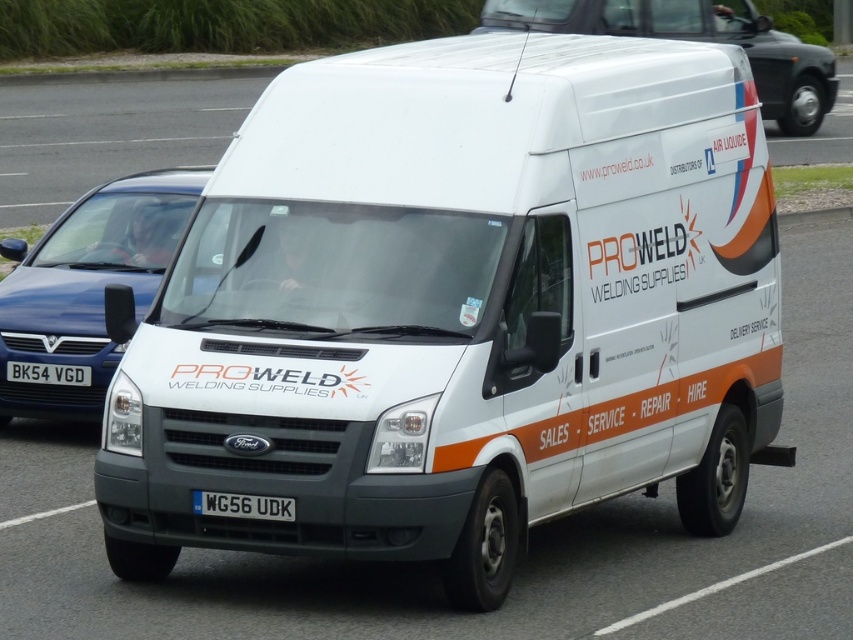
You are standing in front of the van and notice two points marked on its side. The first point is at coordinate (277, 497) and the second is at (21, 369). Which point is closer to you?

Point (277, 497) is closer to the camera than point (21, 369).

You are a delivery driver who needs to confirm the vehicle you are driving matches the company records. According to the image, which object is bigger in size between the white matte van at upper center and the white plastic license plate at center?

The white matte van at upper center is larger in size compared to the white plastic license plate at center.

You are a delivery driver who needs to attach a GPS tracker to your van. The GPS tracker must be placed on the license plate. However, the van has a high roof and the license plate is positioned lower. Given that the white matte van at center is on the left side of the white plastic license plate at center, where should you place the GPS tracker relative to the van?

The white plastic license plate at center is on the right side of the white matte van at center. Therefore, the GPS tracker should be placed on the right side of the van.